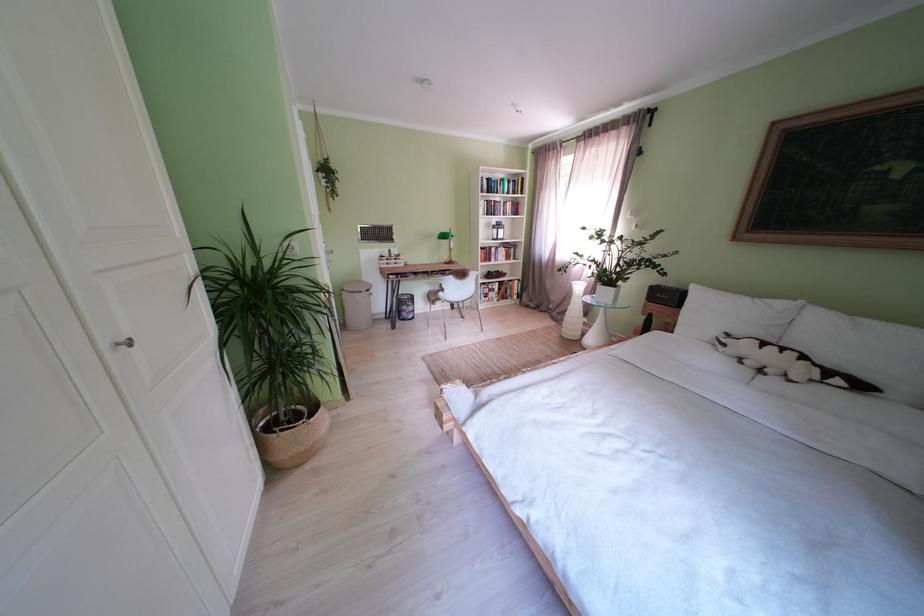
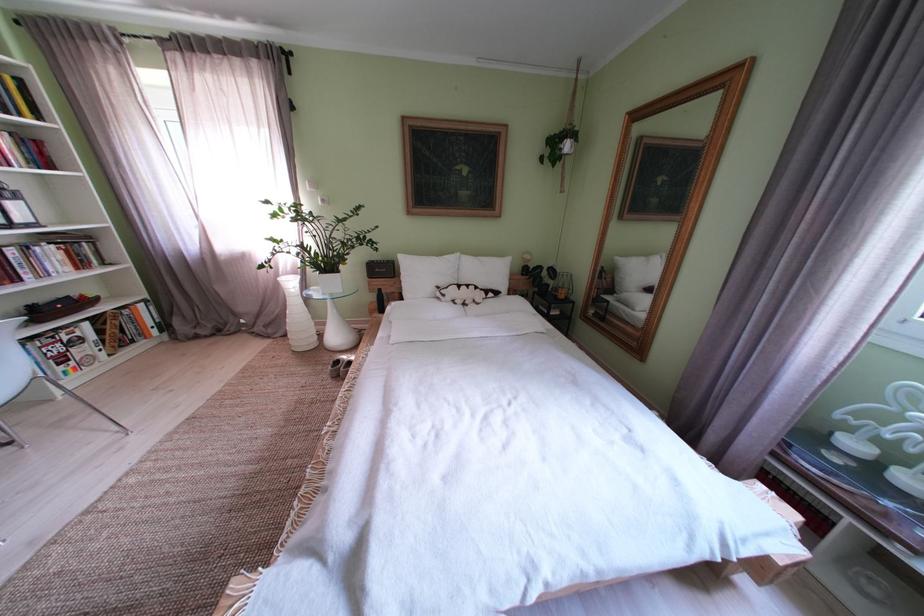
The point at (735, 350) is marked in the first image. Where is the corresponding point in the second image?

(455, 301)